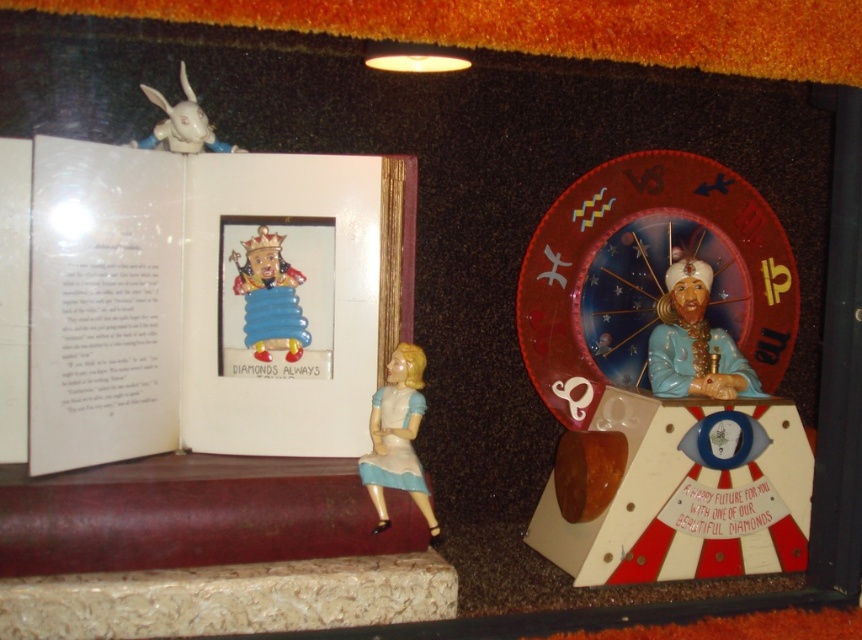
You are an interior designer arranging items on a shelf. You have a matte plastic book at left and a white glossy rabbit at upper left. Which item takes up more vertical space on the shelf?

The matte plastic book at left is much taller than the white glossy rabbit at upper left, so it takes up more vertical space on the shelf.